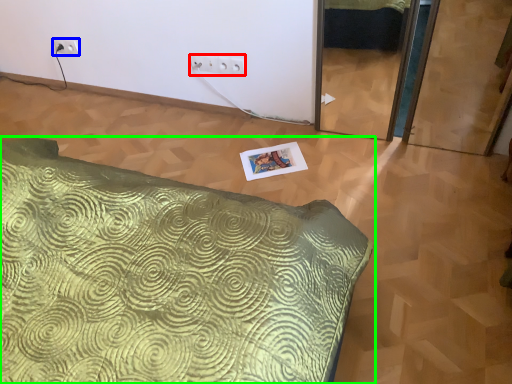
Question: Which object is the farthest from electric outlet (highlighted by a red box)? Choose among these: electric outlet (highlighted by a blue box) or bed (highlighted by a green box).

Choices:
 (A) electric outlet
 (B) bed

Answer: (B)